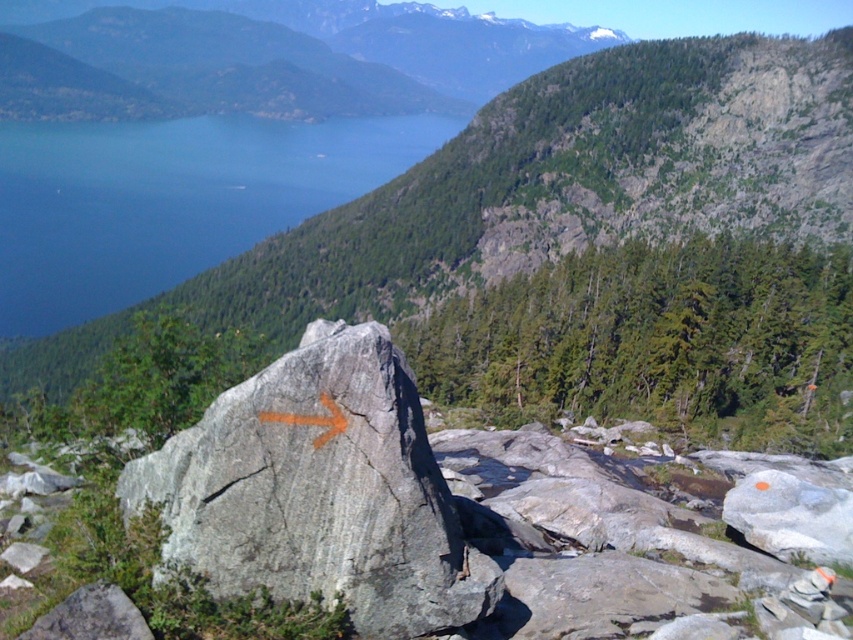
Question: Does granite boulder at center have a larger size compared to orange painted arrow at center?

Choices:
 (A) yes
 (B) no

Answer: (A)

Question: Does blue water at upper left appear on the left side of white smooth rock at lower right?

Choices:
 (A) yes
 (B) no

Answer: (A)

Question: Does blue water at upper left appear under white smooth rock at lower right?

Choices:
 (A) no
 (B) yes

Answer: (A)

Question: Which point is farther to the camera?

Choices:
 (A) blue water at upper left
 (B) orange painted arrow at center
 (C) white smooth rock at lower right

Answer: (A)

Question: Estimate the real-world distances between objects in this image. Which object is closer to the orange painted arrow at center?

Choices:
 (A) green forested mountain at upper center
 (B) gray rough boulder at center
 (C) granite boulder at center

Answer: (B)

Question: Which is farther from the orange painted arrow at center?

Choices:
 (A) green forested mountain at upper center
 (B) white smooth rock at lower right
 (C) blue water at upper left
 (D) gray rough boulder at center

Answer: (A)